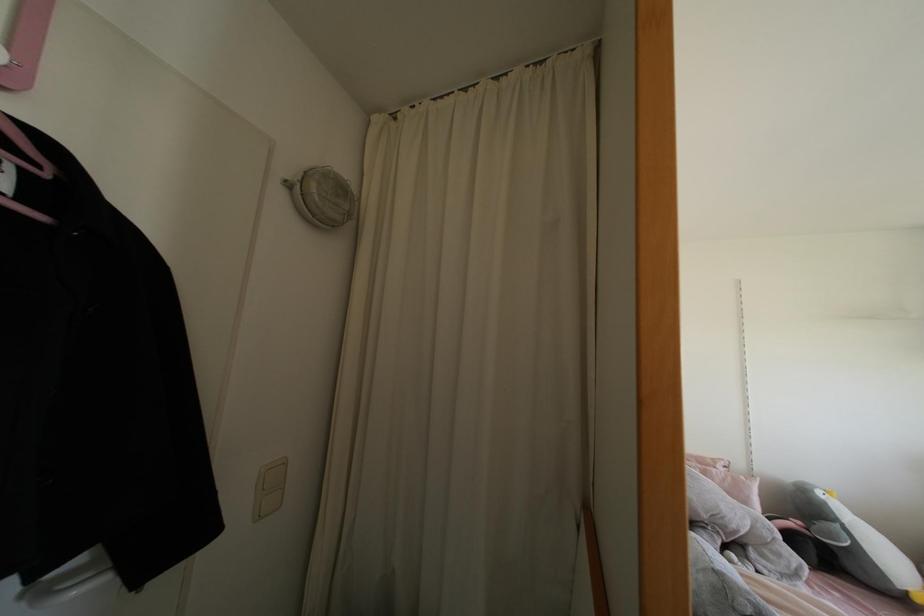
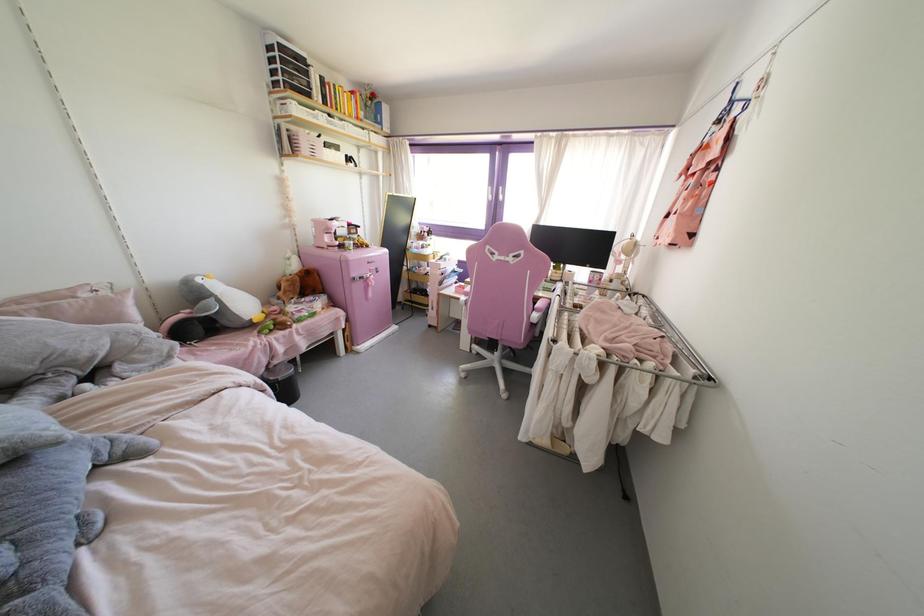
Looking at this image, based on the continuous images, in which direction is the camera rotating?

The camera's rotation is toward right-down.